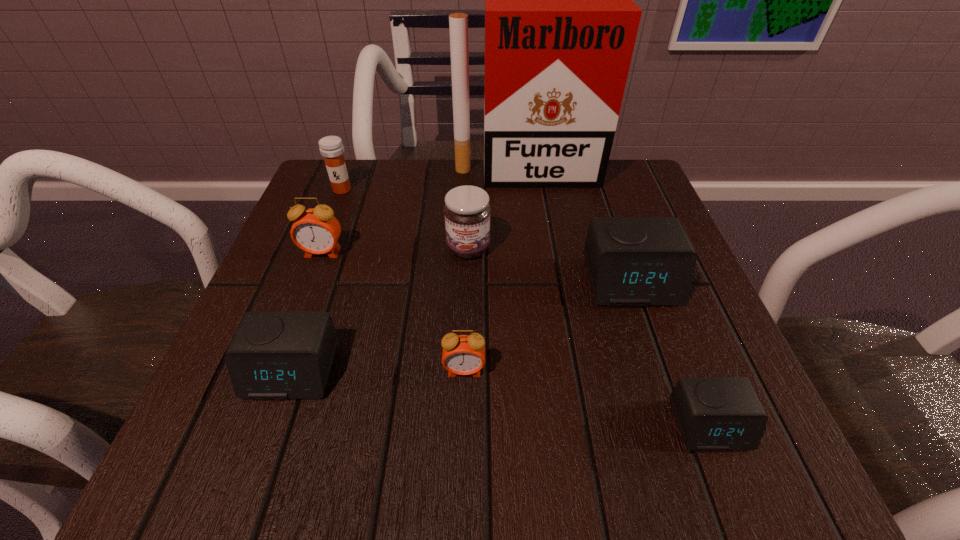
Identify the location of red cigarette case. (560, 23).

You are a GUI agent. You are given a task and a screenshot of the screen. Output one action in this format:
    pyautogui.click(x=<x>, y=<y>)
    Task: Click on the tallest object
    This screenshot has height=540, width=960.
    Given the screenshot: What is the action you would take?
    pyautogui.click(x=560, y=23)

Where is `the tallest alarm clock`? Image resolution: width=960 pixels, height=540 pixels. the tallest alarm clock is located at coordinates (316, 231).

At what (x,y) coordinates should I click in order to perform the action: click on the bigger pink alarm clock. Please return your answer as a coordinate pair (x, y). Image resolution: width=960 pixels, height=540 pixels. Looking at the image, I should click on (316, 231).

You are a GUI agent. You are given a task and a screenshot of the screen. Output one action in this format:
    pyautogui.click(x=<x>, y=<y>)
    Task: Click on the medicine
    This screenshot has height=540, width=960.
    Given the screenshot: What is the action you would take?
    pyautogui.click(x=331, y=148)

This screenshot has width=960, height=540. I want to click on jam, so tap(467, 210).

Locate an element on the screen. Image resolution: width=960 pixels, height=540 pixels. the biggest black alarm clock is located at coordinates (632, 261).

Where is `the nearer pink alarm clock`? Image resolution: width=960 pixels, height=540 pixels. the nearer pink alarm clock is located at coordinates (462, 354).

You are a GUI agent. You are given a task and a screenshot of the screen. Output one action in this format:
    pyautogui.click(x=<x>, y=<y>)
    Task: Click on the smaller pink alarm clock
    This screenshot has width=960, height=540.
    Given the screenshot: What is the action you would take?
    pyautogui.click(x=462, y=354)

In order to click on the second biggest black alarm clock in this screenshot , I will do `click(274, 355)`.